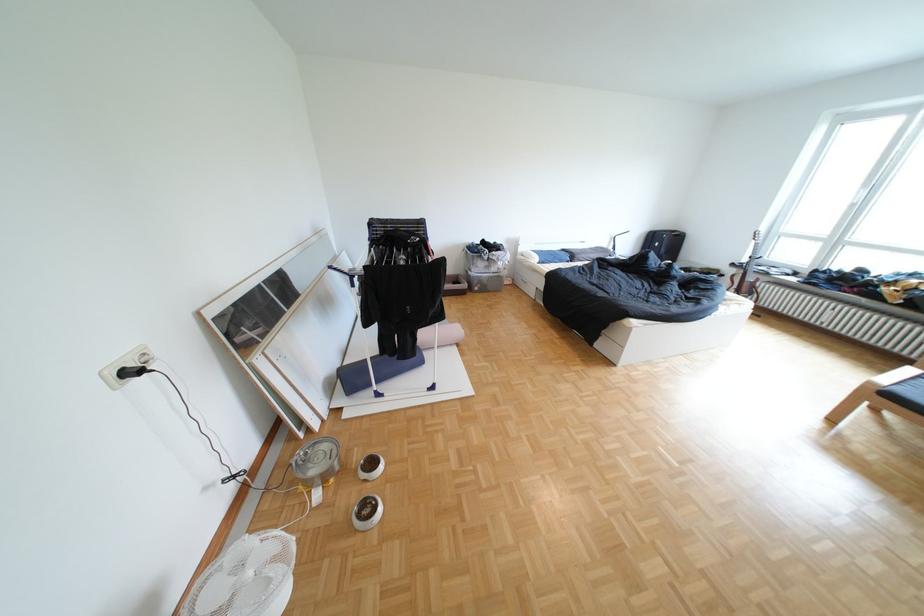
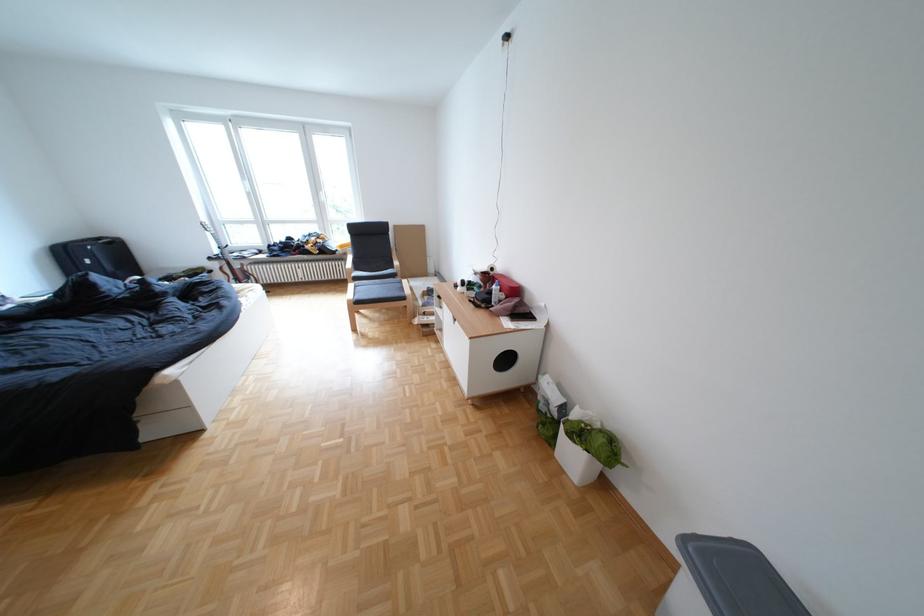
Where in the second image is the point corresponding to [748,265] from the first image?

(225, 259)